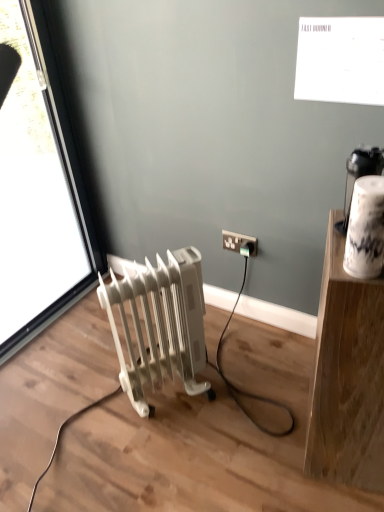
Question: Is white plastic radiator at lower left wider or thinner than white wood shelf at upper right?

Choices:
 (A) wide
 (B) thin

Answer: (B)

Question: Considering their positions, is white plastic radiator at lower left located in front of or behind white wood shelf at upper right?

Choices:
 (A) front
 (B) behind

Answer: (B)

Question: Considering the real-world distances, which object is farthest from the transparent glass window at left?

Choices:
 (A) white plastic socket at lower right
 (B) white wood shelf at upper right
 (C) white plastic radiator at lower left

Answer: (B)

Question: Estimate the real-world distances between objects in this image. Which object is farther from the white wood shelf at upper right?

Choices:
 (A) white plastic socket at lower right
 (B) white plastic radiator at lower left
 (C) transparent glass window at left

Answer: (C)